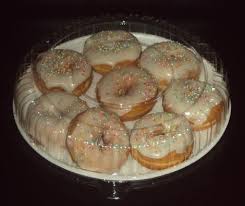
Identify the location of lip of the plate. This screenshot has width=245, height=206. (54, 163).